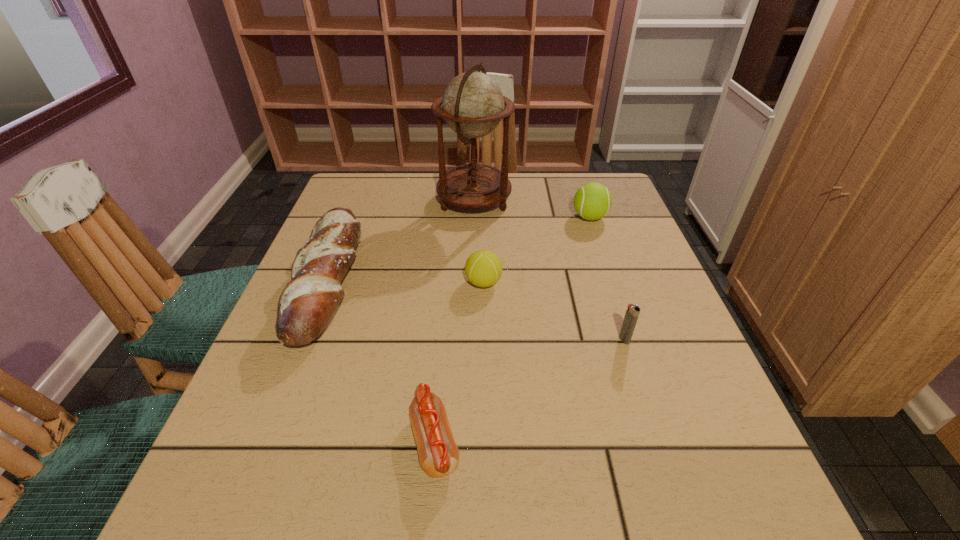
Locate an element on the screen. This screenshot has width=960, height=540. vacant area that lies between the leftmost object and the sausage is located at coordinates (381, 362).

This screenshot has width=960, height=540. In order to click on free space between the nearer tennis ball and the sausage in this screenshot , I will do `click(459, 362)`.

Where is `vacant space that is in between the leftmost object and the right tennis ball`? Image resolution: width=960 pixels, height=540 pixels. vacant space that is in between the leftmost object and the right tennis ball is located at coordinates (459, 249).

You are a GUI agent. You are given a task and a screenshot of the screen. Output one action in this format:
    pyautogui.click(x=<x>, y=<y>)
    Task: Click on the free spot between the left tennis ball and the farther tennis ball
    The height and width of the screenshot is (540, 960).
    Given the screenshot: What is the action you would take?
    pyautogui.click(x=537, y=250)

Locate an element on the screen. The height and width of the screenshot is (540, 960). vacant region between the igniter and the right tennis ball is located at coordinates (607, 279).

Find the location of `empty space between the sausage and the leftmost object`. empty space between the sausage and the leftmost object is located at coordinates (381, 362).

At what (x,y) coordinates should I click in order to perform the action: click on vacant space that's between the nearer tennis ball and the sausage. Please return your answer as a coordinate pair (x, y). The width and height of the screenshot is (960, 540). Looking at the image, I should click on (459, 362).

Find the location of a particular element. The width and height of the screenshot is (960, 540). vacant area between the sausage and the shorter tennis ball is located at coordinates (459, 362).

Identify which object is the fifth nearest to the igniter. Please provide its 2D coordinates. Your answer should be formatted as a tuple, i.e. [(x, y)], where the tuple contains the x and y coordinates of a point satisfying the conditions above.

[(307, 303)]

Where is `object that stands as the fifth closest to the igniter`? object that stands as the fifth closest to the igniter is located at coordinates (307, 303).